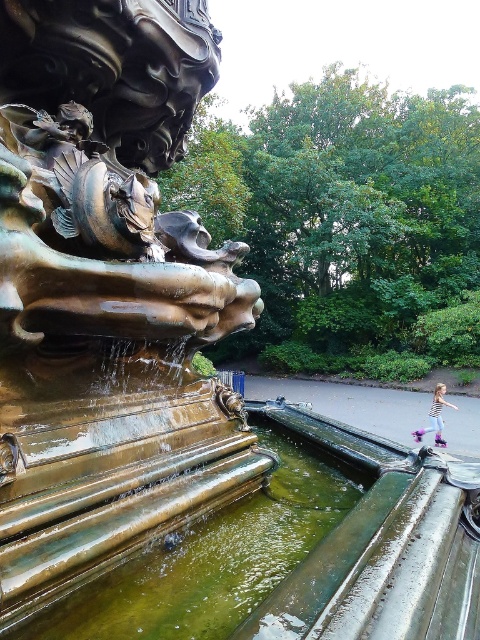
Question: Which of the following is the farthest from the observer?

Choices:
 (A) green metallic water at lower left
 (B) striped t-shirt at lower right

Answer: (B)

Question: Among these points, which one is farthest from the camera?

Choices:
 (A) (160, 579)
 (B) (435, 422)

Answer: (B)

Question: Which point is closer to the camera?

Choices:
 (A) (455, 404)
 (B) (169, 570)

Answer: (B)

Question: Does green metallic water at lower left lie behind striped t-shirt at lower right?

Choices:
 (A) yes
 (B) no

Answer: (B)

Question: In this image, where is green metallic water at lower left located relative to striped t-shirt at lower right?

Choices:
 (A) below
 (B) above

Answer: (B)

Question: Can you confirm if green metallic water at lower left is thinner than striped t-shirt at lower right?

Choices:
 (A) no
 (B) yes

Answer: (A)